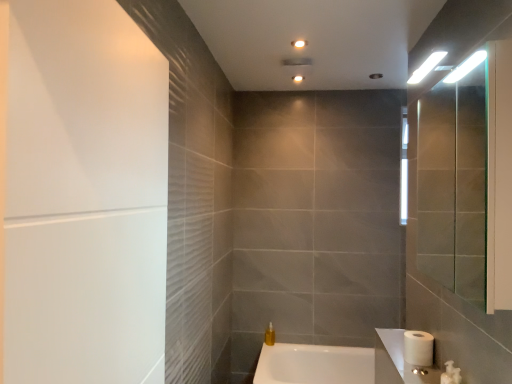
Image resolution: width=512 pixels, height=384 pixels. Identify the location of unoccupied region to the right of matte white ceiling light at upper center. (313, 78).